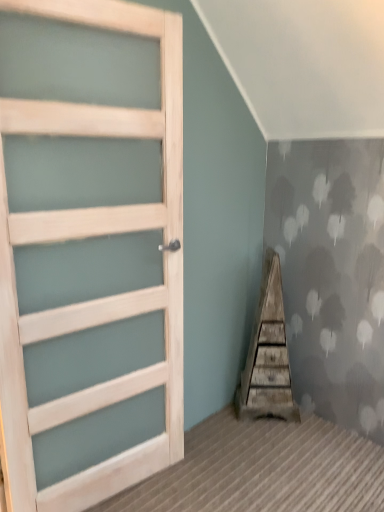
Question: Should I look upward or downward to see weathered wood stairwell at center?

Choices:
 (A) down
 (B) up

Answer: (A)

Question: Is light wood door at left next to weathered wood stairwell at center and touching it?

Choices:
 (A) no
 (B) yes

Answer: (A)

Question: Is light wood door at left closer to the viewer compared to weathered wood stairwell at center?

Choices:
 (A) yes
 (B) no

Answer: (A)

Question: Is light wood door at left at the right side of weathered wood stairwell at center?

Choices:
 (A) yes
 (B) no

Answer: (B)

Question: Considering the relative sizes of light wood door at left and weathered wood stairwell at center in the image provided, is light wood door at left taller than weathered wood stairwell at center?

Choices:
 (A) yes
 (B) no

Answer: (A)

Question: Considering the relative sizes of light wood door at left and weathered wood stairwell at center in the image provided, is light wood door at left thinner than weathered wood stairwell at center?

Choices:
 (A) no
 (B) yes

Answer: (B)

Question: Could you tell me if light wood door at left is facing weathered wood stairwell at center?

Choices:
 (A) yes
 (B) no

Answer: (B)

Question: From a real-world perspective, is weathered wood stairwell at center below light wood door at left?

Choices:
 (A) yes
 (B) no

Answer: (A)

Question: Is the depth of weathered wood stairwell at center greater than that of light wood door at left?

Choices:
 (A) no
 (B) yes

Answer: (B)

Question: Considering the relative sizes of weathered wood stairwell at center and light wood door at left in the image provided, is weathered wood stairwell at center wider than light wood door at left?

Choices:
 (A) no
 (B) yes

Answer: (B)

Question: From a real-world perspective, is weathered wood stairwell at center over light wood door at left?

Choices:
 (A) no
 (B) yes

Answer: (A)

Question: From the image's perspective, is weathered wood stairwell at center under light wood door at left?

Choices:
 (A) yes
 (B) no

Answer: (A)

Question: Is weathered wood stairwell at center thinner than light wood door at left?

Choices:
 (A) yes
 (B) no

Answer: (B)

Question: Would you say weathered wood stairwell at center is to the left or to the right of light wood door at left in the picture?

Choices:
 (A) right
 (B) left

Answer: (A)